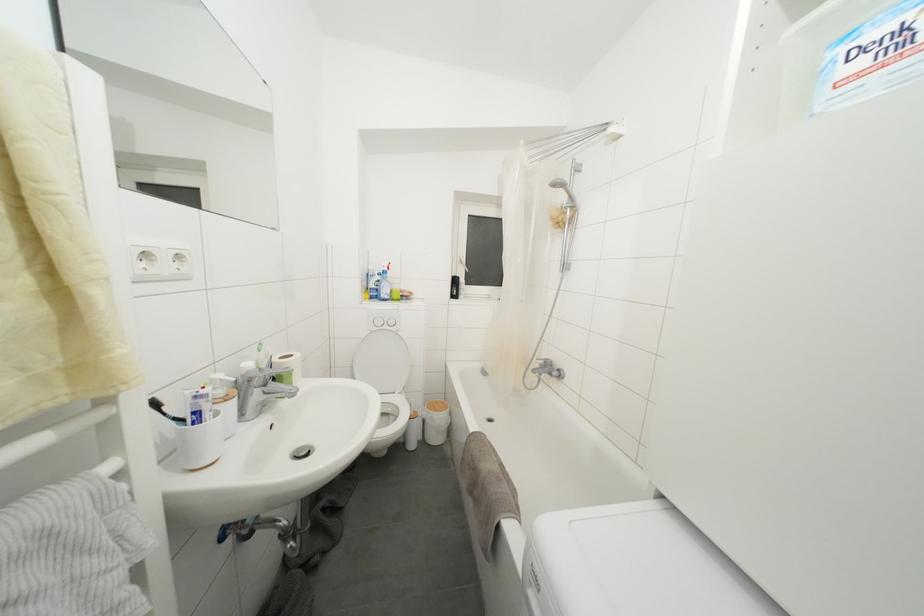
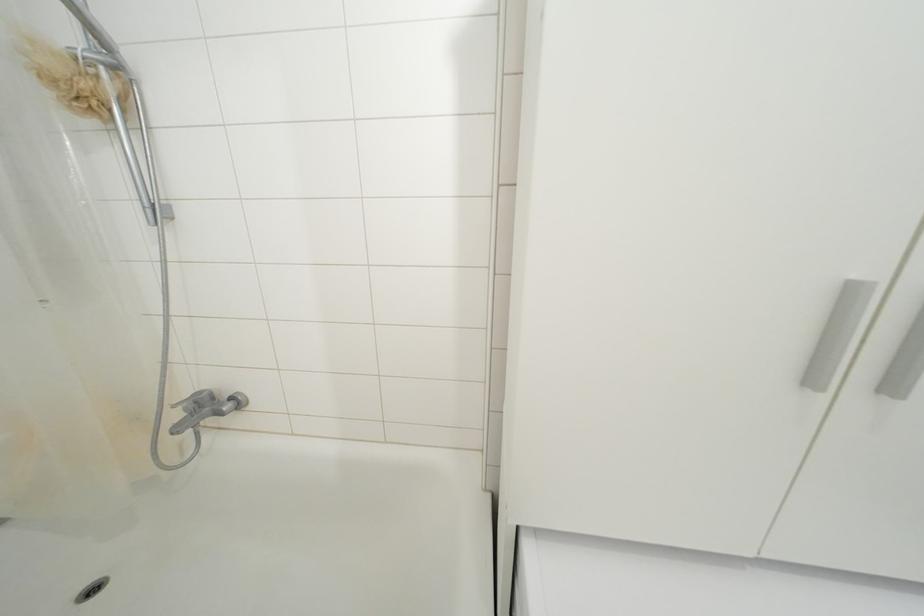
Locate, in the second image, the point that corresponds to [569,217] in the first image.

(100, 79)